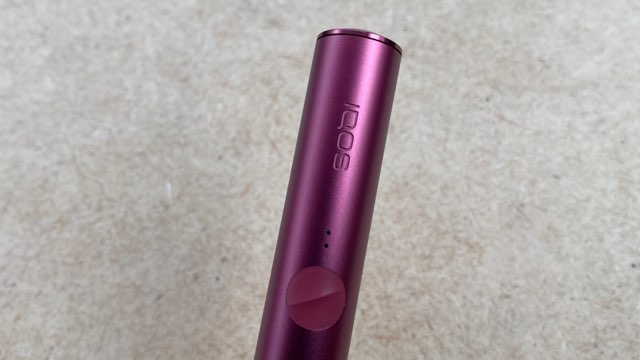
Find the location of a particular element. The width and height of the screenshot is (640, 360). this line on the circle is a knob or dial of some kind is located at coordinates (326, 297).